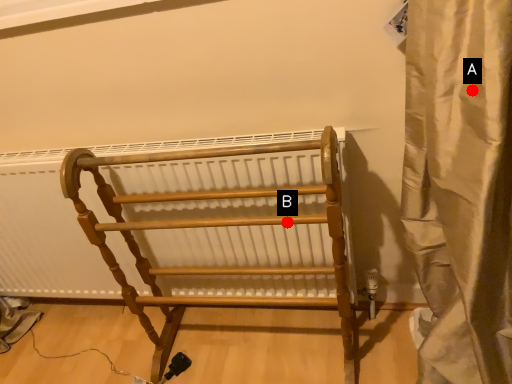
Question: Two points are circled on the image, labeled by A and B beside each circle. Which point is further to the camera?

Choices:
 (A) A is further
 (B) B is further

Answer: (B)